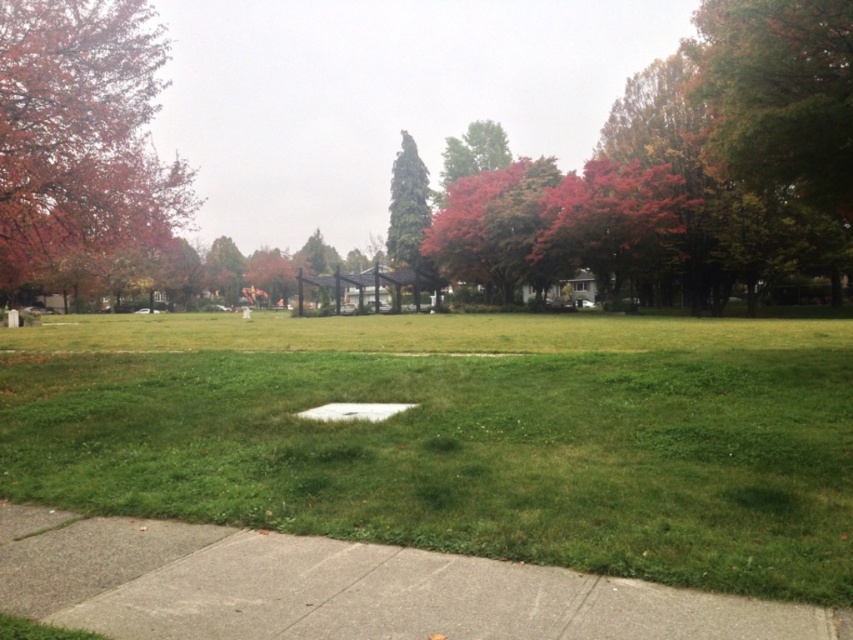
Is green grassy field at center below gray concrete sidewalk at lower left?

Actually, green grassy field at center is above gray concrete sidewalk at lower left.

Image resolution: width=853 pixels, height=640 pixels. I want to click on green grassy field at center, so click(x=462, y=436).

Image resolution: width=853 pixels, height=640 pixels. Identify the location of green grassy field at center. (462, 436).

Which is more to the right, shiny red leaves at upper right or reddish-brown bark tree at center?

From the viewer's perspective, shiny red leaves at upper right appears more on the right side.

Looking at this image, who is more forward, [654,164] or [479,177]?

Point [654,164] is more forward.

Is point (606, 234) farther from viewer compared to point (500, 240)?

No, it is not.

Locate an element on the screen. shiny red leaves at upper right is located at coordinates (614, 224).

Looking at this image, can you confirm if reddish-brown bark tree at left is smaller than shiny red leaves at upper right?

No.

Between reddish-brown bark tree at left and shiny red leaves at upper right, which one appears on the right side from the viewer's perspective?

Positioned to the right is shiny red leaves at upper right.

Image resolution: width=853 pixels, height=640 pixels. In order to click on reddish-brown bark tree at left in this screenshot , I will do `click(80, 134)`.